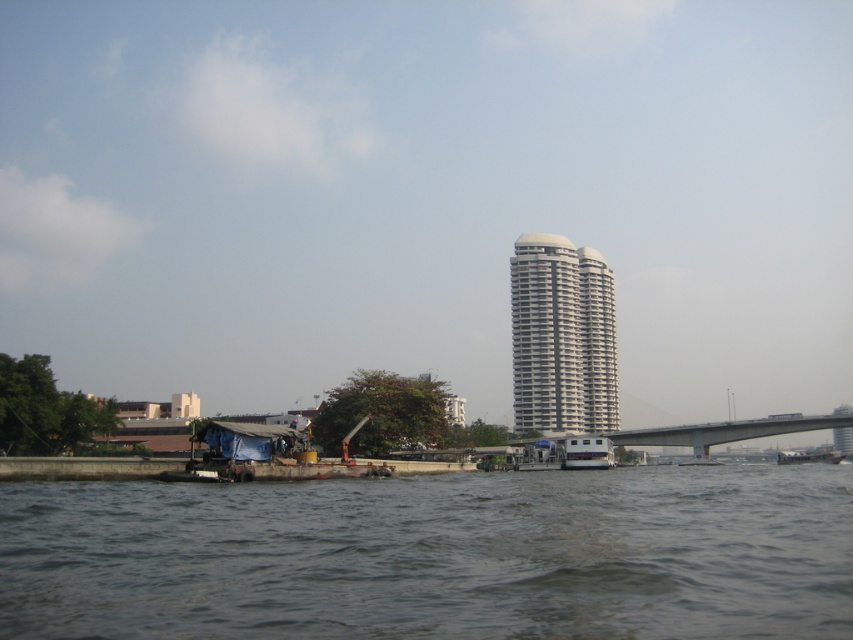
Question: Can you confirm if white smooth building at center is thinner than white plastic boat at center?

Choices:
 (A) yes
 (B) no

Answer: (B)

Question: Considering the real-world distances, which object is farthest from the concrete gray bridge at center right?

Choices:
 (A) white plastic boat at center
 (B) dark gray water at lower center
 (C) white smooth building at center

Answer: (B)

Question: Is concrete gray bridge at center right smaller than white plastic boat at center?

Choices:
 (A) no
 (B) yes

Answer: (A)

Question: Which object appears farthest from the camera in this image?

Choices:
 (A) white smooth building at center
 (B) concrete gray bridge at center right

Answer: (A)

Question: Is dark gray water at lower center thinner than concrete gray bridge at center right?

Choices:
 (A) no
 (B) yes

Answer: (A)

Question: Estimate the real-world distances between objects in this image. Which object is farther from the white smooth building at center?

Choices:
 (A) white plastic boat at center
 (B) concrete gray bridge at center right

Answer: (A)